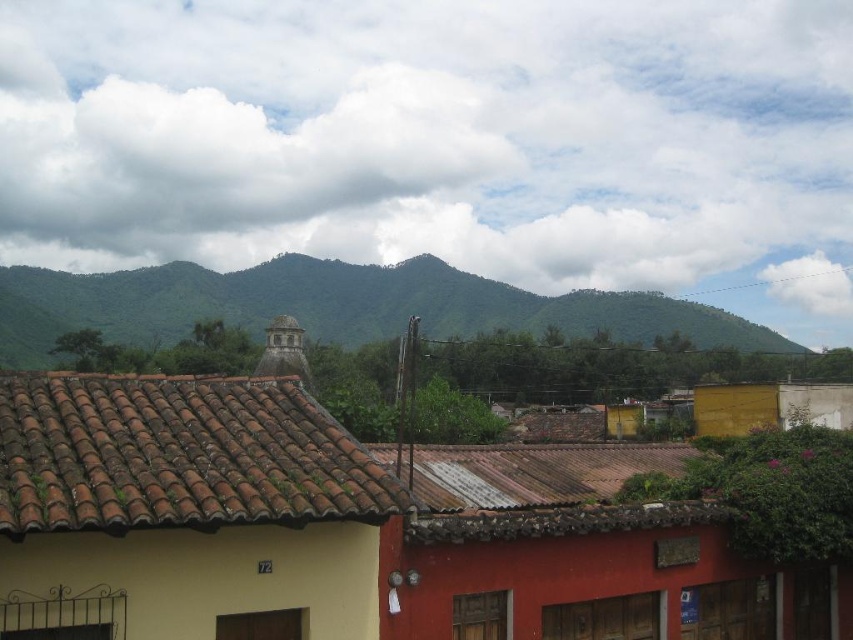
Question: Observing the image, what is the correct spatial positioning of white fluffy cloud at upper center in reference to green leafy mountains at upper center?

Choices:
 (A) below
 (B) above

Answer: (B)

Question: Does white fluffy cloud at upper center come behind brown clay tiles at upper left?

Choices:
 (A) no
 (B) yes

Answer: (B)

Question: Which of the following is the closest to the observer?

Choices:
 (A) (659, 307)
 (B) (561, 8)

Answer: (A)

Question: Does white fluffy cloud at upper center appear under green leafy mountains at upper center?

Choices:
 (A) no
 (B) yes

Answer: (A)

Question: Which point is closer to the camera?

Choices:
 (A) pos(679,60)
 (B) pos(206,524)
 (C) pos(595,307)

Answer: (B)

Question: Which object appears closest to the camera in this image?

Choices:
 (A) green leafy mountains at upper center
 (B) white fluffy cloud at upper center

Answer: (A)